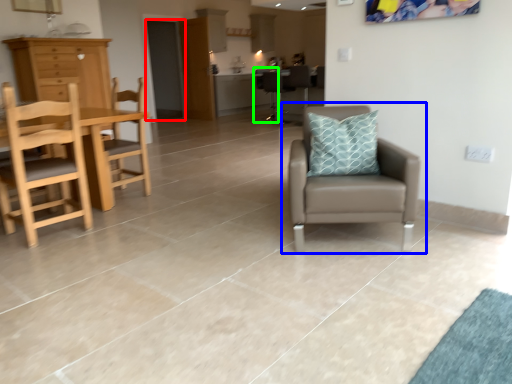
Question: Which object is the closest to the glass door (highlighted by a red box)? Choose among these: chair (highlighted by a blue box) or armchair (highlighted by a green box).

Choices:
 (A) chair
 (B) armchair

Answer: (B)